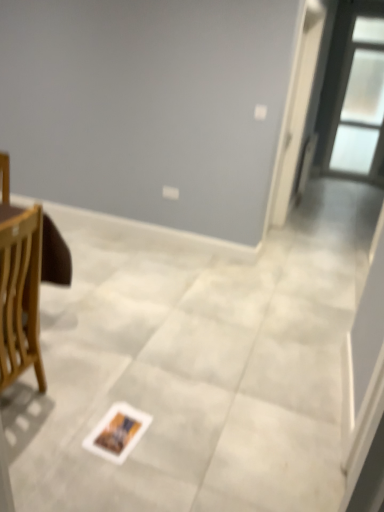
What are the coordinates of `free space above white paper postcard at center (from a real-world perspective)` in the screenshot? It's located at coord(119,419).